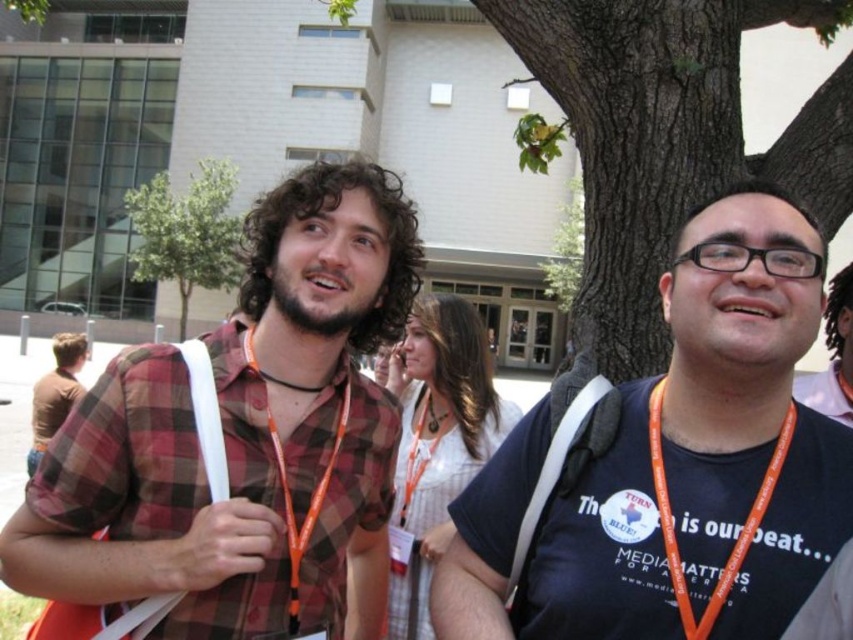
Is point (573, 81) farther from camera compared to point (282, 316)?

Yes.

Find the location of `brown rough bark tree at upper center`. brown rough bark tree at upper center is located at coordinates (666, 138).

Is point (596, 0) less distant than point (286, 326)?

No, it is behind (286, 326).

What are the coordinates of `brown rough bark tree at upper center` in the screenshot? It's located at (666, 138).

At what (x,y) coordinates should I click in order to perform the action: click on white cotton shirt at center. Please return your answer as a coordinate pair (x, y). Looking at the image, I should click on (436, 444).

What do you see at coordinates (436, 444) in the screenshot? The width and height of the screenshot is (853, 640). I see `white cotton shirt at center` at bounding box center [436, 444].

What do you see at coordinates (436, 444) in the screenshot? I see `white cotton shirt at center` at bounding box center [436, 444].

In order to click on white cotton shirt at center in this screenshot , I will do `click(436, 444)`.

Who is higher up, plaid cotton shirt at center or matte black shirt at center?

matte black shirt at center

Is plaid cotton shirt at center taller than matte black shirt at center?

Indeed, plaid cotton shirt at center has a greater height compared to matte black shirt at center.

This screenshot has height=640, width=853. In order to click on plaid cotton shirt at center in this screenshot , I will do `click(242, 444)`.